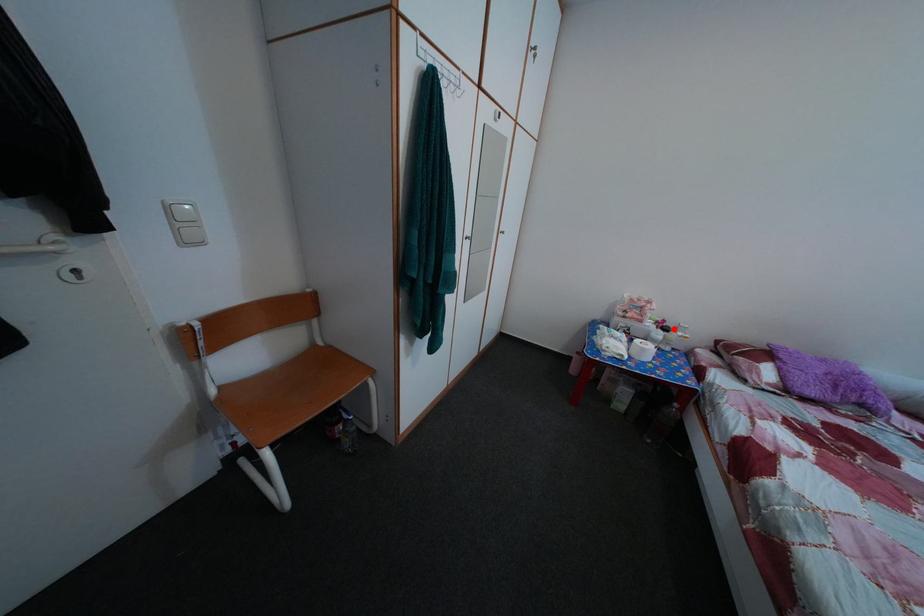
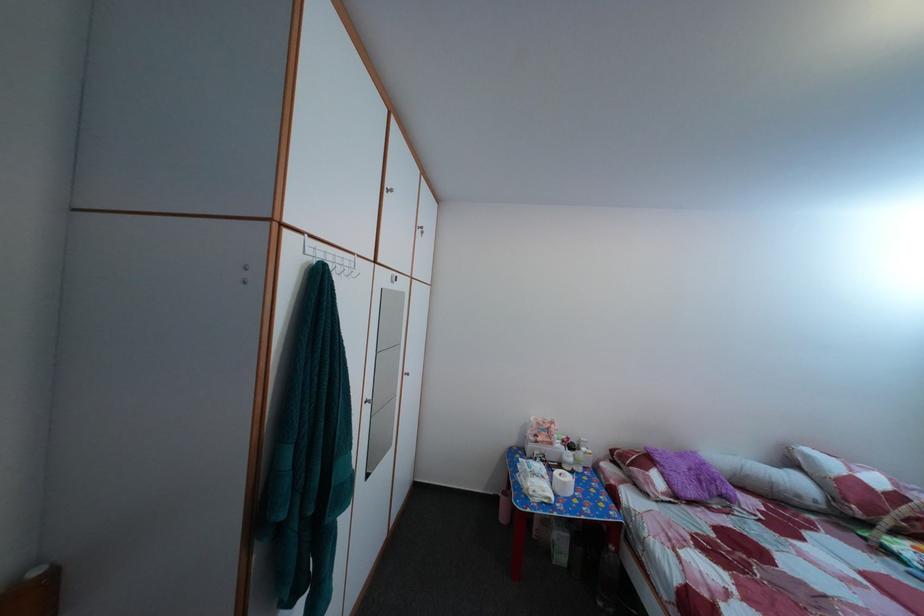
Where in the second image is the point corresponding to the highlighted location from the first image?

(578, 447)